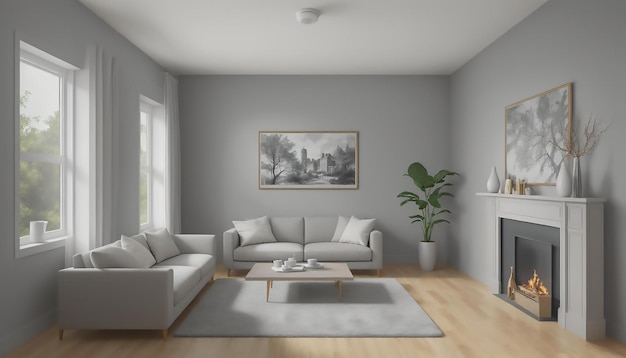
In order to click on sofa in this screenshot , I will do `click(191, 259)`.